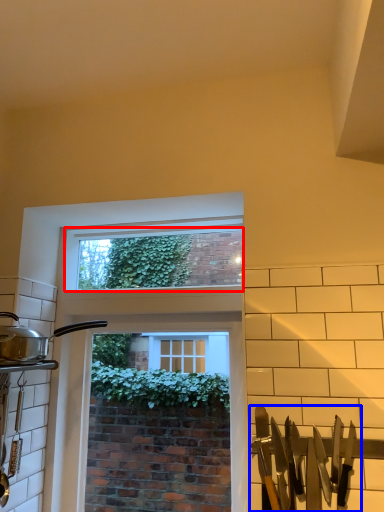
Question: Which of the following is the closest to the observer, window screen (highlighted by a red box) or silverware (highlighted by a blue box)?

Choices:
 (A) window screen
 (B) silverware

Answer: (B)